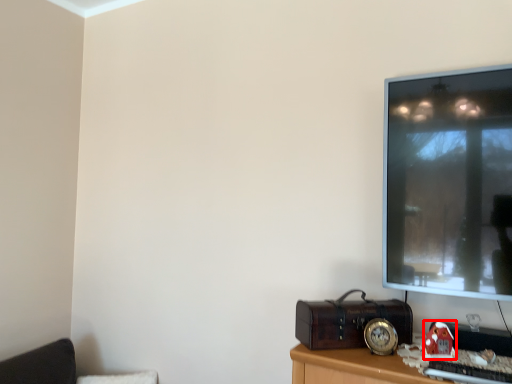
Question: From the image's perspective, considering the relative positions of toy (annotated by the red box) and furniture in the image provided, where is toy (annotated by the red box) located with respect to the staircase?

Choices:
 (A) below
 (B) above

Answer: (B)